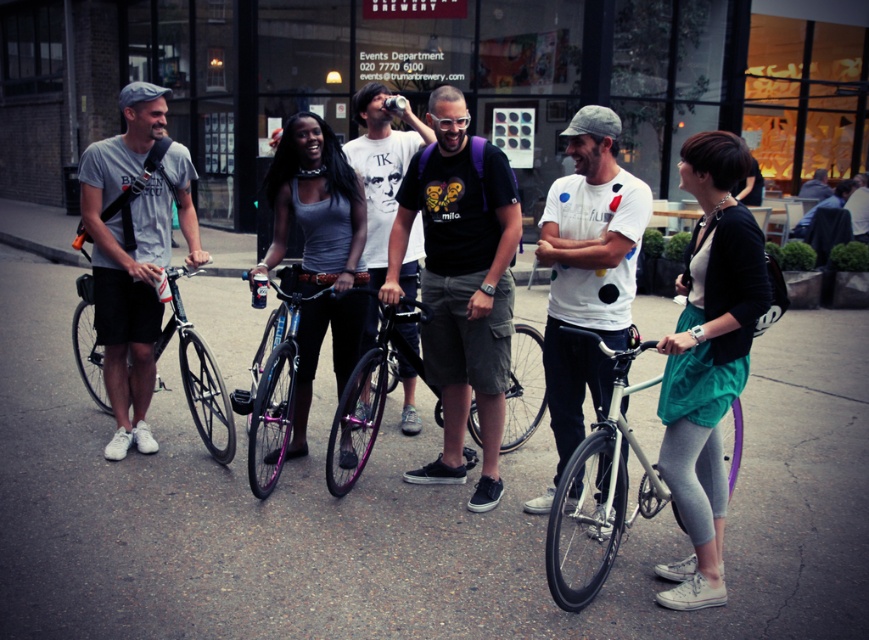
You are a photographer trying to capture a candid shot of the matte gray tank top at center and the shiny black bicycle at left. Since you want to frame both subjects in the same photo, which direction should you move to ensure both are visible in your camera viewfinder?

You should move to the right of the shiny black bicycle at left to include both the matte gray tank top at center and the shiny black bicycle at left in your camera viewfinder since the matte gray tank top at center is positioned to the right of the shiny black bicycle at left.

You are standing in the Truman Brewery area and want to take a photo of two specific points marked in the image. The first point is at coordinate point (x=362, y=284) and the second is at coordinate point (x=202, y=433). Which point will appear larger in your camera view?

Point (x=362, y=284) is closer to the camera than point (x=202, y=433), so it will appear larger in the camera view.